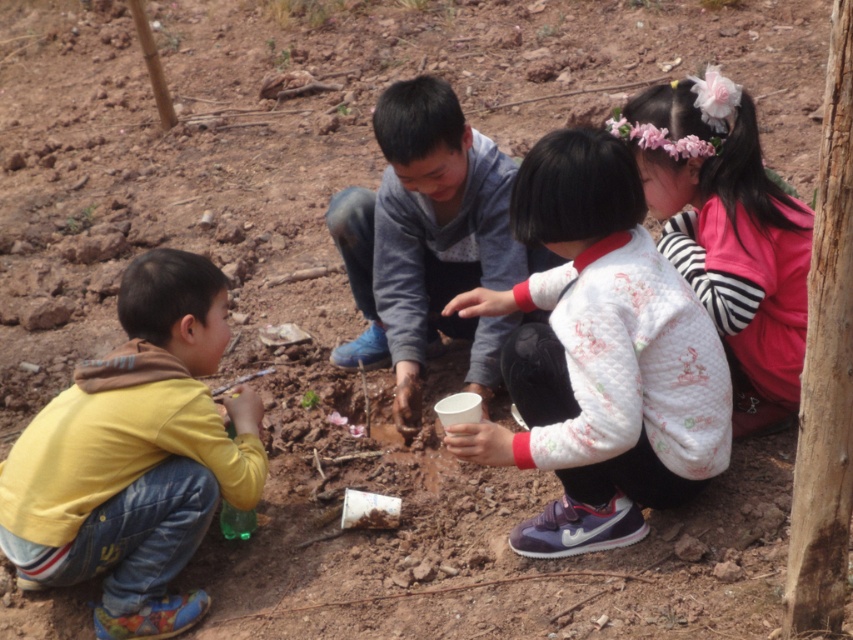
You are a photographer standing at the camera position. You want to take a photo focusing on the two points in the image. Which point, point 1 at coordinates (485, 422) or point 2 at (775, 392), will appear larger in the photo?

Point 1 at coordinates (485, 422) will appear larger in the photo because it is closer to the camera than point 2 at (775, 392).

You are a photographer trying to capture the scene of the children gardening. You want to focus on the dirty clay hands at center and the fluffy pink hairband at upper right. Which object should you adjust your camera to focus on first if you want to ensure both are in the frame?

The dirty clay hands at center is located above the fluffy pink hairband at upper right, so you should focus on the dirty clay hands at center first to ensure both are in the frame.